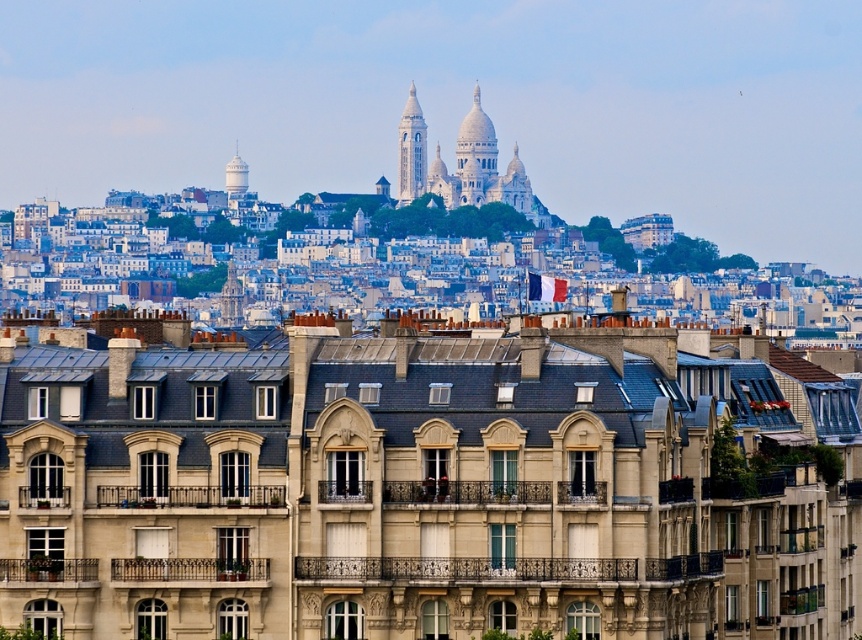
In the scene shown: You are standing in the cityscape and want to determine which of the two points, point (478, 156) or point (423, 147), is closer to you. Based on the scene description, can you identify which point is nearer?

Point (423, 147) is closer to you because it is less further to the camera than point (478, 156).

You are standing at the point labeled point [475,156] in the cityscape image. What architectural feature are you facing?

The point labeled point [475,156] corresponds to the white stone dome at center, so you are facing the white stone dome at center.